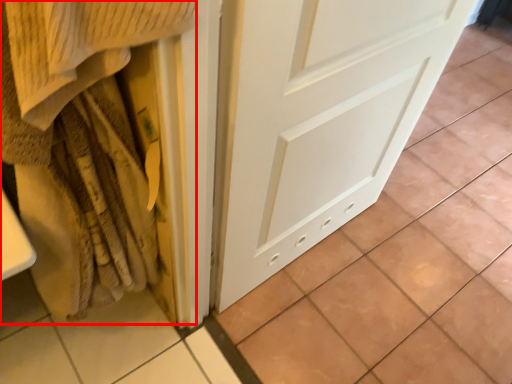
Question: From the image, what is the correct spatial relationship of blanket (annotated by the red box) in relation to door?

Choices:
 (A) left
 (B) right

Answer: (A)